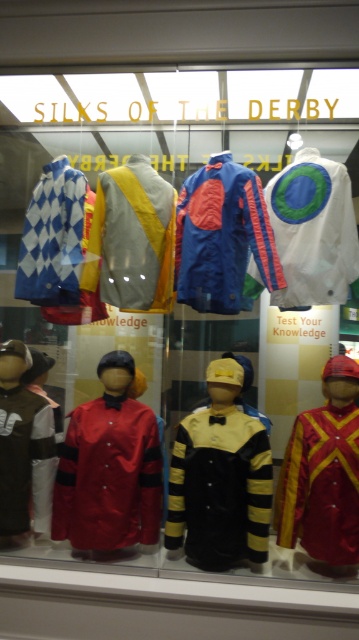
You are a curator planning to add a new silk to the display. The new silk must be placed to the right of the blue satin racing jacket at center. Where should you position it?

The new silk should be placed to the right of the blue satin racing jacket at center, which is located at point (221, 236). Since the jacket is at the center, positioning the new silk to its right would mean placing it at a coordinate with a higher x value than 0.370, such as (221, 288).

You are a curator organizing an exhibition. You need to place a new label next to the blue satin racing jacket at center. The label should be placed at a coordinate that is 0.05 units to the right and 0.03 units above the point marked at point (221, 236). What are the new coordinates for the label?

The new coordinates for the label would be calculated by adding 0.05 to the x coordinate and subtracting 0.03 from the y coordinate of the original point. The original coordinates are (221, 236). Adding 0.05 to 0.370 gives 0.420, and subtracting 0.03 from 0.618 gives 0.588. Therefore, the new coordinates are 0.420, 0.588.